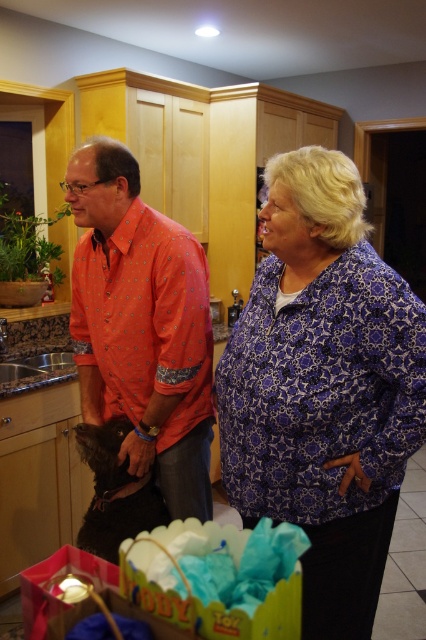
Does purple printed blouse at center have a greater width compared to orange dotted shirt at center?

No.

Looking at this image, does purple printed blouse at center appear on the left side of orange dotted shirt at center?

Incorrect, purple printed blouse at center is not on the left side of orange dotted shirt at center.

Locate an element on the screen. The height and width of the screenshot is (640, 426). purple printed blouse at center is located at coordinates (324, 388).